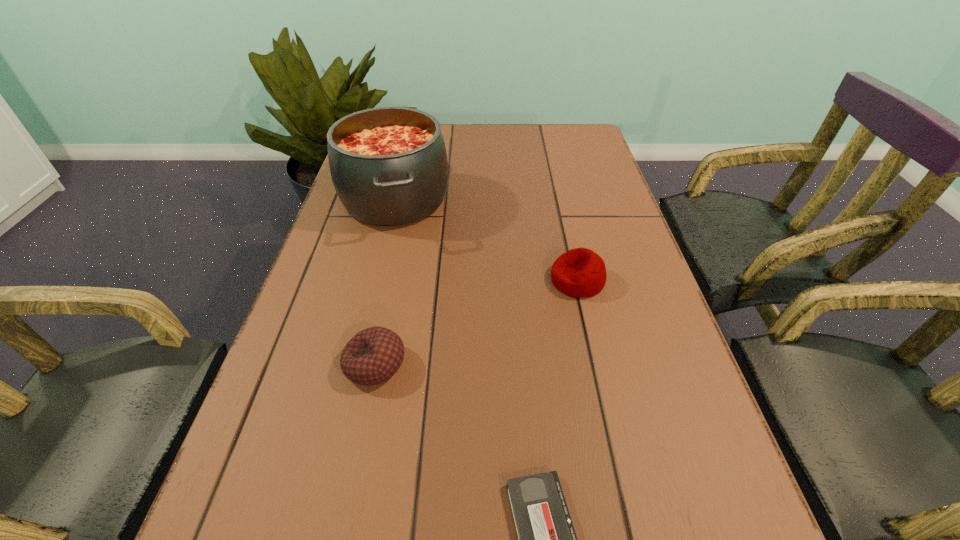
Find the location of `casserole`. casserole is located at coordinates (389, 167).

The image size is (960, 540). I want to click on the farthest object, so click(389, 167).

Image resolution: width=960 pixels, height=540 pixels. Identify the location of the right beanbag. (579, 273).

Where is `the second farthest object`? The width and height of the screenshot is (960, 540). the second farthest object is located at coordinates (579, 273).

Find the location of `the nearer beanbag`. the nearer beanbag is located at coordinates (373, 355).

Locate an element on the screen. the left beanbag is located at coordinates (373, 355).

The height and width of the screenshot is (540, 960). Identify the location of blank area located 0.310m on the front of the farthest object. (358, 352).

Identify the location of free spot located on the seat area of the farther beanbag. point(417,280).

I want to click on vacant space located 0.290m on the seat area of the farther beanbag, so click(417, 280).

Image resolution: width=960 pixels, height=540 pixels. Find the location of `vacant space positioned on the seat area of the farther beanbag`. vacant space positioned on the seat area of the farther beanbag is located at coordinates (481, 280).